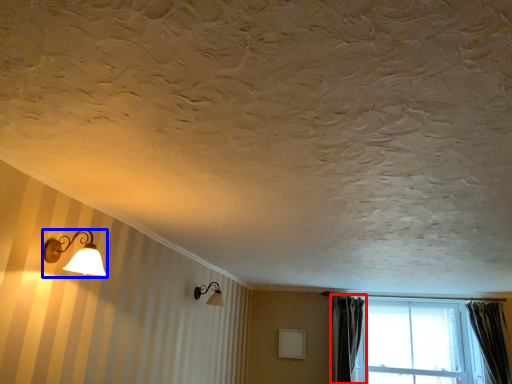
Question: Among these objects, which one is farthest to the camera, curtain (highlighted by a red box) or lamp (highlighted by a blue box)?

Choices:
 (A) curtain
 (B) lamp

Answer: (A)